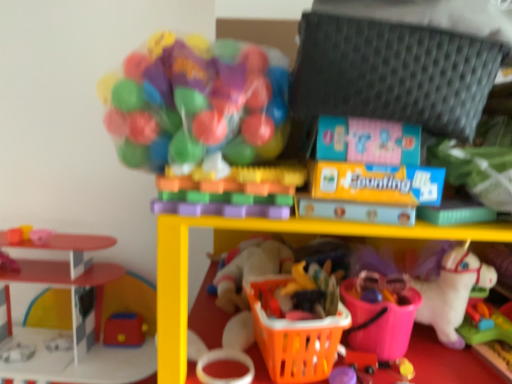
Question: Is smooth plastic toy at left, the first toy from the left, positioned behind pink rubber ball at left, the second toy in the left-to-right sequence?

Choices:
 (A) no
 (B) yes

Answer: (B)

Question: Is pink rubber ball at left, the 7th toy from the right, completely or partially inside smooth plastic toy at left, which is the 8th toy from right to left?

Choices:
 (A) yes
 (B) no

Answer: (B)

Question: Is smooth plastic toy at left, the first toy from the left, aimed at pink rubber ball at left, the 7th toy from the right?

Choices:
 (A) yes
 (B) no

Answer: (B)

Question: Can you confirm if smooth plastic toy at left, the first toy from the left, is smaller than pink rubber ball at left, the second toy in the left-to-right sequence?

Choices:
 (A) yes
 (B) no

Answer: (B)

Question: Is smooth plastic toy at left, which is the 8th toy from right to left, not close to pink rubber ball at left, the 7th toy from the right?

Choices:
 (A) yes
 (B) no

Answer: (B)

Question: In terms of height, does smooth plastic toy at left, which is the 8th toy from right to left, look taller or shorter compared to rubberized red toy at lower left, the fourth toy viewed from the left?

Choices:
 (A) short
 (B) tall

Answer: (A)

Question: Would you say smooth plastic toy at left, the first toy from the left, is inside or outside rubberized red toy at lower left, the fourth toy viewed from the left?

Choices:
 (A) inside
 (B) outside

Answer: (B)

Question: Relative to rubberized red toy at lower left, acting as the 5th toy starting from the right, is smooth plastic toy at left, which is the 8th toy from right to left, in front or behind?

Choices:
 (A) behind
 (B) front

Answer: (B)

Question: From a real-world perspective, is smooth plastic toy at left, which is the 8th toy from right to left, above or below rubberized red toy at lower left, acting as the 5th toy starting from the right?

Choices:
 (A) below
 (B) above

Answer: (B)

Question: Considering the positions of smooth plastic toy at left, which is the 8th toy from right to left, and translucent plastic ball pit at upper center, which ranks as the fifth toy in left-to-right order, in the image, is smooth plastic toy at left, which is the 8th toy from right to left, wider or thinner than translucent plastic ball pit at upper center, which ranks as the fifth toy in left-to-right order,?

Choices:
 (A) thin
 (B) wide

Answer: (A)

Question: From a real-world perspective, is smooth plastic toy at left, which is the 8th toy from right to left, above or below translucent plastic ball pit at upper center, which ranks as the fifth toy in left-to-right order?

Choices:
 (A) above
 (B) below

Answer: (B)

Question: Considering the positions of point (18, 226) and point (273, 198), is point (18, 226) closer or farther from the camera than point (273, 198)?

Choices:
 (A) farther
 (B) closer

Answer: (A)

Question: Is smooth plastic toy at left, which is the 8th toy from right to left, spatially inside translucent plastic ball pit at upper center, which ranks as the fifth toy in left-to-right order, or outside of it?

Choices:
 (A) inside
 (B) outside

Answer: (B)

Question: Does point (275, 193) appear closer or farther from the camera than point (225, 226)?

Choices:
 (A) farther
 (B) closer

Answer: (B)

Question: Considering their positions, is translucent plastic blocks at center, which is the 3th toy in right-to-left order, located in front of or behind orange plastic basket at lower center?

Choices:
 (A) behind
 (B) front

Answer: (B)